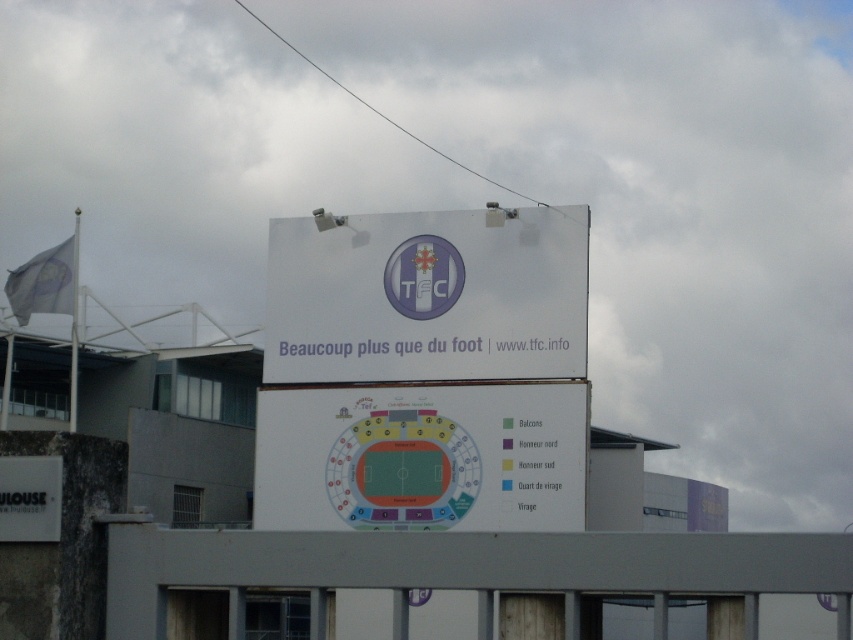
Based on the photo, you are standing in front of the billboard and want to read both the white paper at center and the white matte sign at lower left. Which one can you read first without moving your head?

The white paper at center is closer to you than the white matte sign at lower left, so you can read the white paper at center first without moving your head.

You are a visitor at the sports facility and want to find the white paper sign at center. According to the scene description, where is it placed in relation to the billboard sections?

The white paper sign at center is located at point (x=427, y=296) on the billboard, which places it in the lower section where the seating plan is displayed.

From the picture: You are a visitor at the sports facility and want to check the seating plan. You see a white paper at center and a white matte sign at lower left. Which object should you look at to find the seating plan information?

The white paper at center contains the seating plan information because it is located below the white matte sign at lower left, which likely indicates hierarchy or placement of important details.